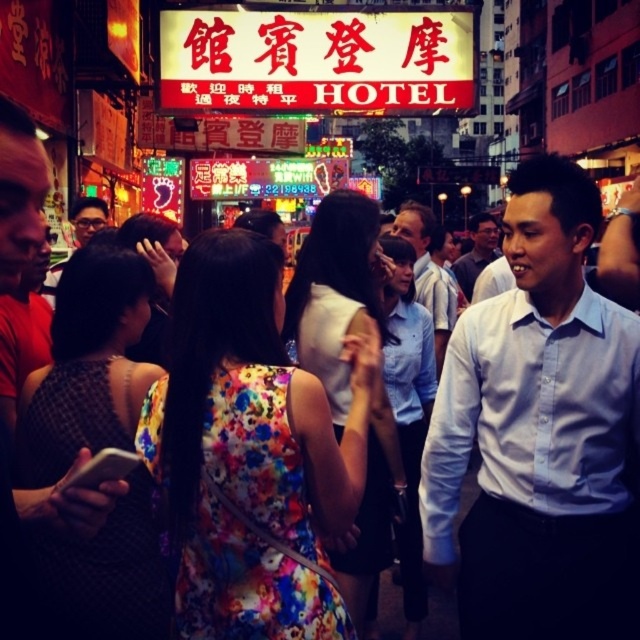
You are standing at the center of the street and see two points in the scene. Which point is closer to you, point (570,387) or point (472,266)?

Point (570,387) is closer to the viewer than point (472,266).

You are a pedestrian standing on the street and looking up at the hotel sign. There is a red plastic sign at upper center and a matte white shirt at center. Which object is higher in the scene?

The red plastic sign at upper center is higher than the matte white shirt at center.

You are a pedestrian trying to read the red plastic sign at upper center while standing near the matte white shirt at center. Which direction should you move to face the sign properly?

The red plastic sign at upper center is to the left of the matte white shirt at center. To face the sign properly, you should move to your left so that the sign comes into view on your left side.